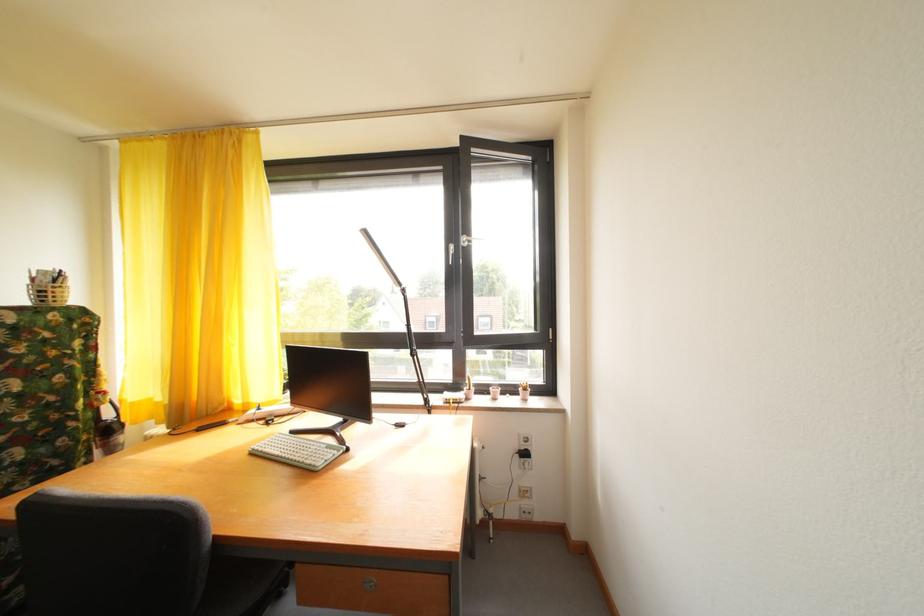
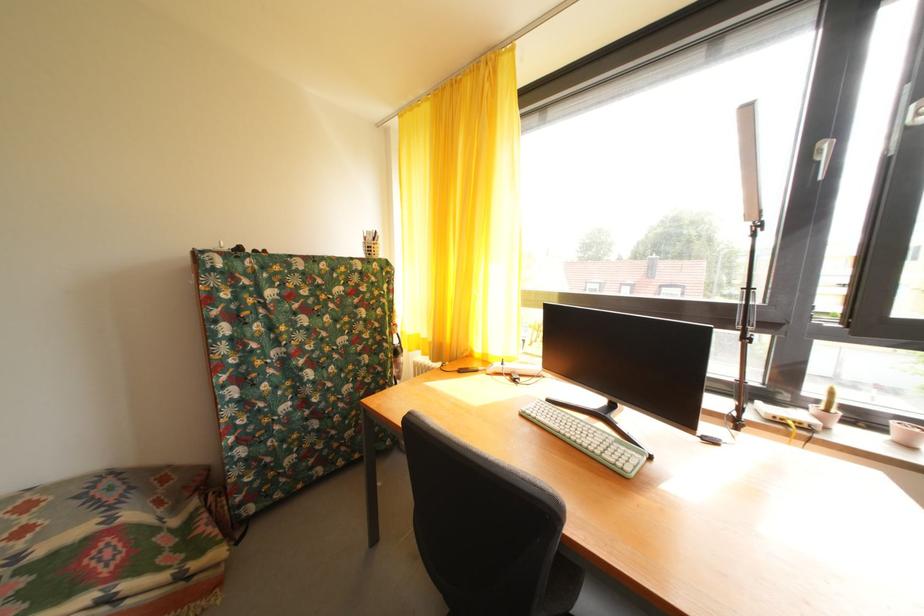
Question: The camera is either moving clockwise (left) or counter-clockwise (right) around the object. The first image is from the beginning of the video and the second image is from the end. Is the camera moving left or right when shooting the video?

Choices:
 (A) Left
 (B) Right

Answer: (B)